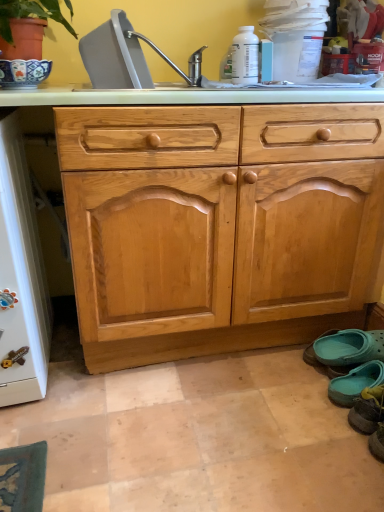
Find the location of a particular element. This screenshot has height=512, width=384. white glossy refrigerator at left is located at coordinates (20, 276).

The height and width of the screenshot is (512, 384). Describe the element at coordinates (173, 63) in the screenshot. I see `silver metallic faucet at upper center, acting as the first sink starting from the back` at that location.

At what (x,y) coordinates should I click in order to perform the action: click on white glossy refrigerator at left. Please return your answer as a coordinate pair (x, y). The width and height of the screenshot is (384, 512). Looking at the image, I should click on (20, 276).

Is teal fabric slipper at lower right, the second footwear when ordered from front to back, at the back of silver metallic faucet at upper center, the 2th sink from the front?

silver metallic faucet at upper center, the 2th sink from the front, is not turned away from teal fabric slipper at lower right, the second footwear when ordered from front to back.

Does point (197, 77) appear closer or farther from the camera than point (349, 391)?

Point (197, 77) appears to be farther away from the viewer than point (349, 391).

Which is correct: silver metallic faucet at upper center, the 2th sink from the front, is inside teal fabric slipper at lower right, the second footwear when ordered from front to back, or outside of it?

→ silver metallic faucet at upper center, the 2th sink from the front, is located beyond the bounds of teal fabric slipper at lower right, the second footwear when ordered from front to back.

From the image's perspective, which one is positioned higher, silver metallic faucet at upper center, the 2th sink from the front, or teal fabric slipper at lower right, the second footwear when ordered from front to back?

silver metallic faucet at upper center, the 2th sink from the front, appears higher in the image.

What's the angular difference between gray plastic sink at upper center, which ranks as the first sink in front-to-back order, and white glossy refrigerator at left's facing directions?

gray plastic sink at upper center, which ranks as the first sink in front-to-back order, and white glossy refrigerator at left are facing 0.00288 degrees away from each other.

Considering the relative positions of gray plastic sink at upper center, placed as the 2th sink when sorted from back to front, and white glossy refrigerator at left in the image provided, is gray plastic sink at upper center, placed as the 2th sink when sorted from back to front, behind white glossy refrigerator at left?

Yes.

Is point (128, 52) behind point (7, 157)?

Yes.

Can you confirm if gray plastic sink at upper center, which ranks as the first sink in front-to-back order, is wider than white glossy refrigerator at left?

No, gray plastic sink at upper center, which ranks as the first sink in front-to-back order, is not wider than white glossy refrigerator at left.

Does light brown wood drawer at center turn towards teal fabric slipper at lower right, which is counted as the second footwear, starting from the back?

No, light brown wood drawer at center is not turned towards teal fabric slipper at lower right, which is counted as the second footwear, starting from the back.

Can you confirm if light brown wood drawer at center is thinner than teal fabric slipper at lower right, which is counted as the second footwear, starting from the back?

In fact, light brown wood drawer at center might be wider than teal fabric slipper at lower right, which is counted as the second footwear, starting from the back.

Considering the positions of point (80, 49) and point (379, 365), is point (80, 49) closer or farther from the camera than point (379, 365)?

Point (80, 49) is closer to the camera than point (379, 365).

Which object is positioned more to the left, gray plastic sink at upper center, which ranks as the first sink in front-to-back order, or teal fabric slipper at lower right, which is counted as the second footwear, starting from the back?

Positioned to the left is gray plastic sink at upper center, which ranks as the first sink in front-to-back order.

Is gray plastic sink at upper center, which ranks as the first sink in front-to-back order, outside of teal fabric slipper at lower right, the second footwear when ordered from front to back?

gray plastic sink at upper center, which ranks as the first sink in front-to-back order, is positioned outside teal fabric slipper at lower right, the second footwear when ordered from front to back.

This screenshot has height=512, width=384. What are the coordinates of `the 2nd footwear positioned below the gray plastic sink at upper center, placed as the 2th sink when sorted from back to front (from the image's perspective)` in the screenshot? It's located at (355, 383).

Is teal rubber clogs at lower right, the third footwear from the front, beside teal fabric slipper at lower right, the 3th footwear from the back?

No, teal rubber clogs at lower right, the third footwear from the front, is not in contact with teal fabric slipper at lower right, the 3th footwear from the back.

Is teal rubber clogs at lower right, the third footwear from the front, bigger than teal fabric slipper at lower right, the 3th footwear from the back?

Incorrect, teal rubber clogs at lower right, the third footwear from the front, is not larger than teal fabric slipper at lower right, the 3th footwear from the back.

The width and height of the screenshot is (384, 512). I want to click on the 2nd footwear to the right of the teal rubber clogs at lower right, acting as the 1th footwear starting from the back, counting from the anchor's position, so click(x=368, y=410).

Choose the correct answer: Is white glossy refrigerator at left inside silver metallic faucet at upper center, the 2th sink from the front, or outside it?

white glossy refrigerator at left is not inside silver metallic faucet at upper center, the 2th sink from the front, it's outside.

Based on the photo, who is smaller, white glossy refrigerator at left or silver metallic faucet at upper center, the 2th sink from the front?

With smaller size is silver metallic faucet at upper center, the 2th sink from the front.

From the picture: Are white glossy refrigerator at left and silver metallic faucet at upper center, acting as the first sink starting from the back, beside each other?

white glossy refrigerator at left is not next to silver metallic faucet at upper center, acting as the first sink starting from the back, and they're not touching.

Considering the relative positions of teal rubber clogs at lower right, acting as the 1th footwear starting from the back, and white glossy refrigerator at left in the image provided, is teal rubber clogs at lower right, acting as the 1th footwear starting from the back, to the left of white glossy refrigerator at left from the viewer's perspective?

No, teal rubber clogs at lower right, acting as the 1th footwear starting from the back, is not to the left of white glossy refrigerator at left.

Which object is wider, teal rubber clogs at lower right, the third footwear from the front, or white glossy refrigerator at left?

white glossy refrigerator at left.

Does teal rubber clogs at lower right, acting as the 1th footwear starting from the back, turn towards white glossy refrigerator at left?

Yes, teal rubber clogs at lower right, acting as the 1th footwear starting from the back, is aimed at white glossy refrigerator at left.

Is teal rubber clogs at lower right, acting as the 1th footwear starting from the back, beside white glossy refrigerator at left?

No, teal rubber clogs at lower right, acting as the 1th footwear starting from the back, is not next to white glossy refrigerator at left.

There is a teal fabric slipper at lower right, which is counted as the second footwear, starting from the back. Identify the location of the 2nd sink above it (from the image's perspective). The image size is (384, 512). (173, 63).

From the white glossy refrigerator at left, count 1st sinks backward and point to it. Please provide its 2D coordinates.

[(126, 57)]

Estimate the real-world distances between objects in this image. Which object is further from teal fabric slipper at lower right, arranged as the first footwear when viewed from the front, white glossy refrigerator at left or teal rubber clogs at lower right, the third footwear from the front?

white glossy refrigerator at left is further to teal fabric slipper at lower right, arranged as the first footwear when viewed from the front.

Which object lies nearer to the anchor point silver metallic faucet at upper center, the 2th sink from the front, teal fabric slipper at lower right, the 3th footwear from the back, or teal rubber clogs at lower right, acting as the 1th footwear starting from the back?

teal rubber clogs at lower right, acting as the 1th footwear starting from the back, is positioned closer to the anchor silver metallic faucet at upper center, the 2th sink from the front.

Which object lies nearer to the anchor point silver metallic faucet at upper center, the 2th sink from the front, gray plastic sink at upper center, which ranks as the first sink in front-to-back order, or light brown wood drawer at center?

Based on the image, gray plastic sink at upper center, which ranks as the first sink in front-to-back order, appears to be nearer to silver metallic faucet at upper center, the 2th sink from the front.

Estimate the real-world distances between objects in this image. Which object is closer to gray plastic sink at upper center, placed as the 2th sink when sorted from back to front, white glossy refrigerator at left or teal fabric slipper at lower right, arranged as the first footwear when viewed from the front?

white glossy refrigerator at left is positioned closer to the anchor gray plastic sink at upper center, placed as the 2th sink when sorted from back to front.

Estimate the real-world distances between objects in this image. Which object is closer to teal fabric slipper at lower right, the 3th footwear from the back, white glossy refrigerator at left or gray plastic sink at upper center, placed as the 2th sink when sorted from back to front?

The object closer to teal fabric slipper at lower right, the 3th footwear from the back, is white glossy refrigerator at left.

When comparing their distances from gray plastic sink at upper center, which ranks as the first sink in front-to-back order, does teal rubber clogs at lower right, acting as the 1th footwear starting from the back, or white glossy refrigerator at left seem closer?

white glossy refrigerator at left is closer to gray plastic sink at upper center, which ranks as the first sink in front-to-back order.

Considering their positions, is teal fabric slipper at lower right, the second footwear when ordered from front to back, positioned closer to gray plastic sink at upper center, which ranks as the first sink in front-to-back order, than white glossy refrigerator at left?

The object closer to gray plastic sink at upper center, which ranks as the first sink in front-to-back order, is white glossy refrigerator at left.

Which object lies further to the anchor point teal fabric slipper at lower right, arranged as the first footwear when viewed from the front, silver metallic faucet at upper center, acting as the first sink starting from the back, or white glossy refrigerator at left?

silver metallic faucet at upper center, acting as the first sink starting from the back, is further to teal fabric slipper at lower right, arranged as the first footwear when viewed from the front.

Locate an element on the screen. sink located between light brown wood drawer at center and silver metallic faucet at upper center, acting as the first sink starting from the back, in the depth direction is located at coordinates (126, 57).

In order to click on drawer between gray plastic sink at upper center, which ranks as the first sink in front-to-back order, and teal rubber clogs at lower right, the third footwear from the front, in the up-down direction in this screenshot , I will do `click(215, 135)`.

Locate an element on the screen. drawer that lies between gray plastic sink at upper center, placed as the 2th sink when sorted from back to front, and teal fabric slipper at lower right, which is counted as the second footwear, starting from the back, from top to bottom is located at coordinates (215, 135).

The width and height of the screenshot is (384, 512). Identify the location of sink between silver metallic faucet at upper center, the 2th sink from the front, and teal fabric slipper at lower right, the second footwear when ordered from front to back, in the up-down direction. (126, 57).